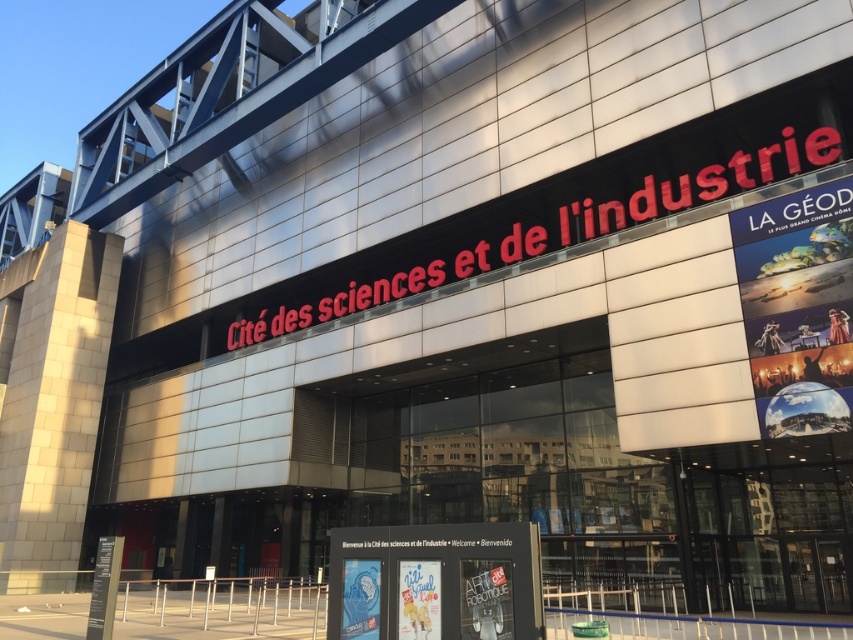
Question: Can you confirm if metallic poster at right is positioned above white plastic sign at center?

Choices:
 (A) no
 (B) yes

Answer: (B)

Question: Which of the following is the closest to the observer?

Choices:
 (A) (408, 570)
 (B) (816, 330)

Answer: (A)

Question: Does metallic poster at right lie in front of white plastic sign at center?

Choices:
 (A) yes
 (B) no

Answer: (B)

Question: Is metallic poster at right smaller than white plastic sign at center?

Choices:
 (A) no
 (B) yes

Answer: (A)